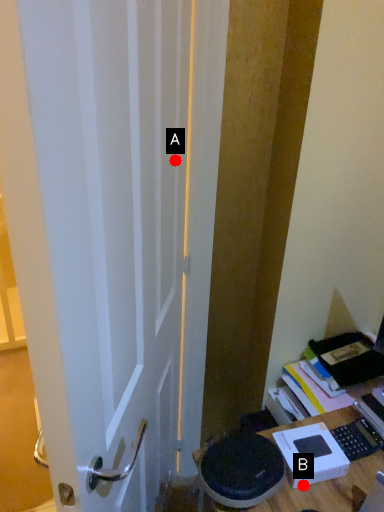
Question: Two points are circled on the image, labeled by A and B beside each circle. Which point is closer to the camera taking this photo?

Choices:
 (A) A is closer
 (B) B is closer

Answer: (B)